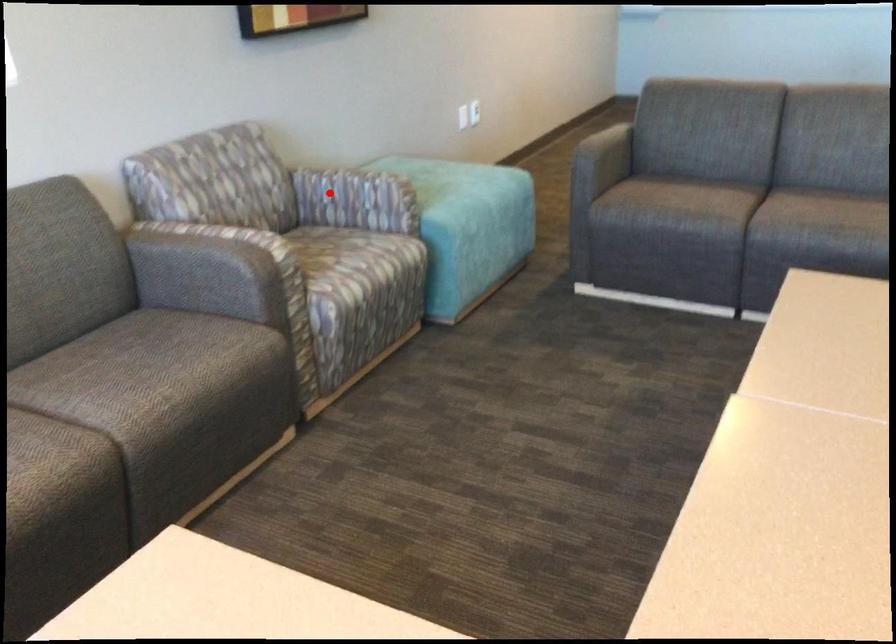
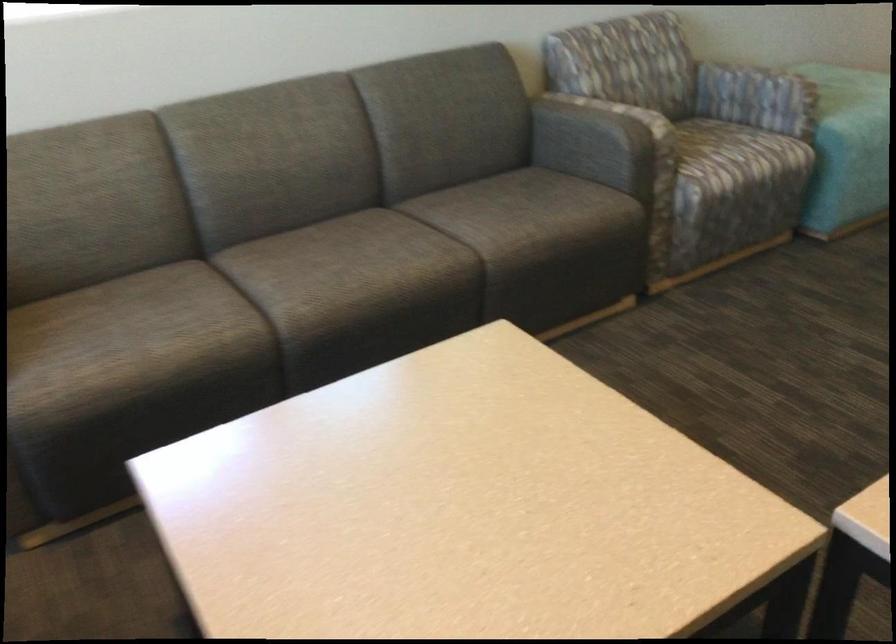
Locate, in the second image, the point that corresponds to the highlighted location in the first image.

(728, 84)